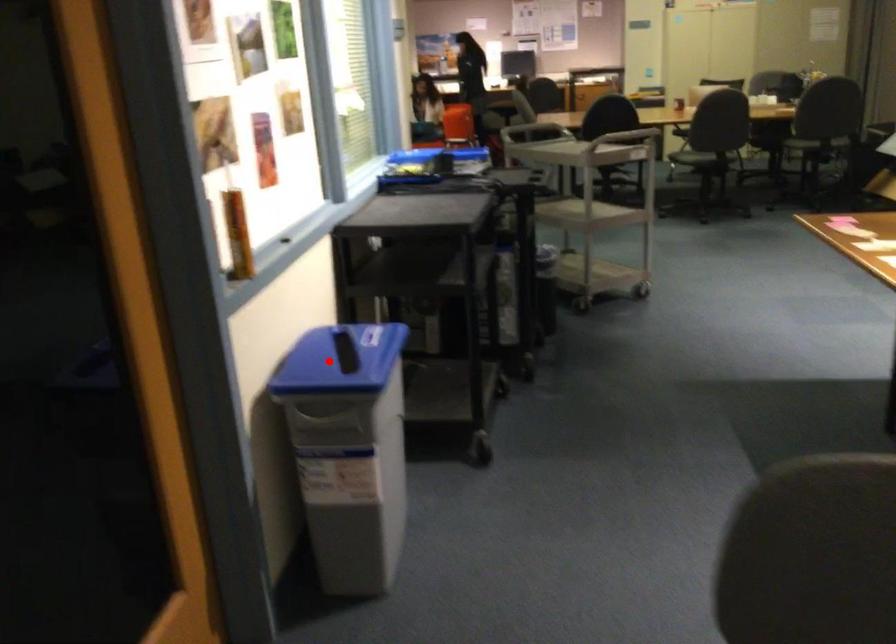
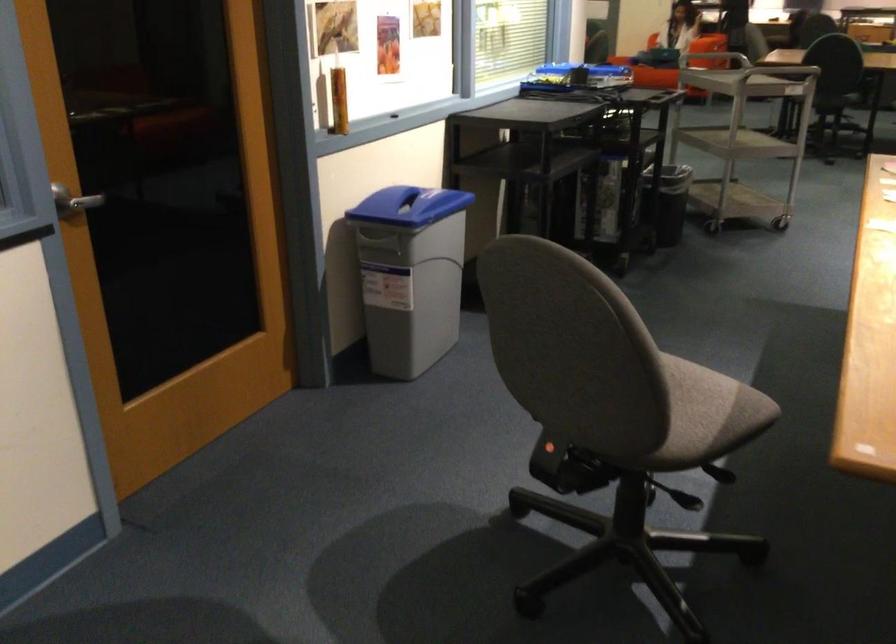
Where in the second image is the point corresponding to the highlighted location from the first image?

(409, 205)